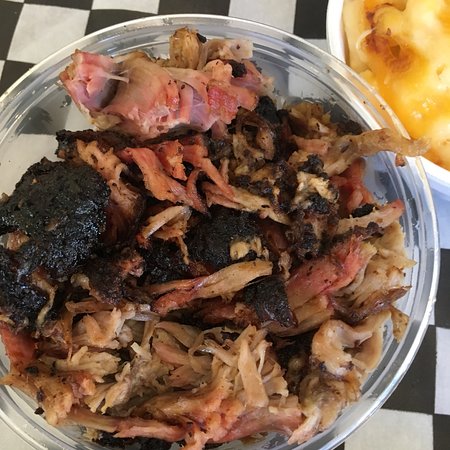
You are a GUI agent. You are given a task and a screenshot of the screen. Output one action in this format:
    pyautogui.click(x=<x>, y=<y>)
    Task: Click on the table cloth
    The width and height of the screenshot is (450, 450).
    Given the screenshot: What is the action you would take?
    pyautogui.click(x=421, y=397), pyautogui.click(x=264, y=16)